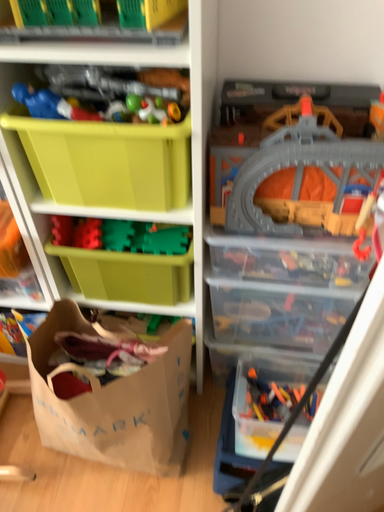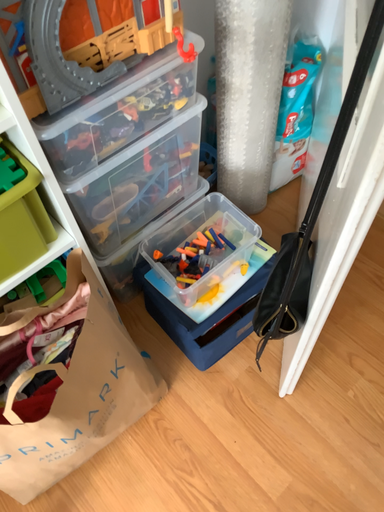
Question: Which way did the camera rotate in the video?

Choices:
 (A) rotated left
 (B) rotated right

Answer: (B)